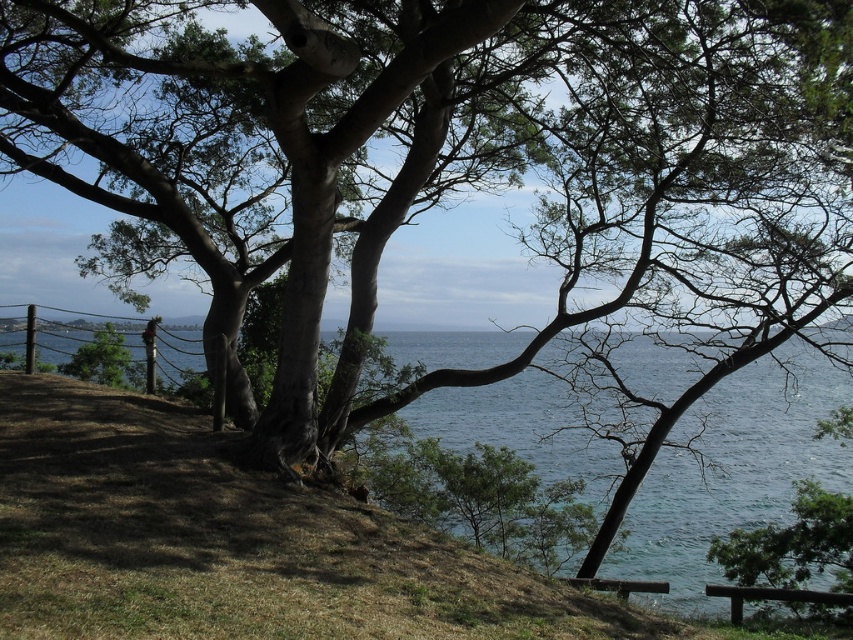
You are standing at the point with coordinates point at (790,554). Looking towards the green leafy tree at lower right, which direction should you walk to reach the tree?

Since the point at (790,554) is already at the green leafy tree at lower right, you are already at the tree.

You are a photographer planning to take a picture of the green leafy tree at lower right and the brown wooden bench at lower right. Based on their sizes in the scene, which object would occupy more space in your photo?

The green leafy tree at lower right occupies more space in the photo because its width is larger than the brown wooden bench at lower right.

You are a visitor sitting on the brown wooden bench at lower right and want to take a photo of the green leafy tree at lower right. Since the bench is at the edge of the scene, will the tree be fully visible in your photo if you frame the shot with the bench in the foreground?

The green leafy tree at lower right is located below the brown wooden bench at lower right, so if you frame the shot with the bench in the foreground, the tree will be partially blocked by the bench and not fully visible in the photo.